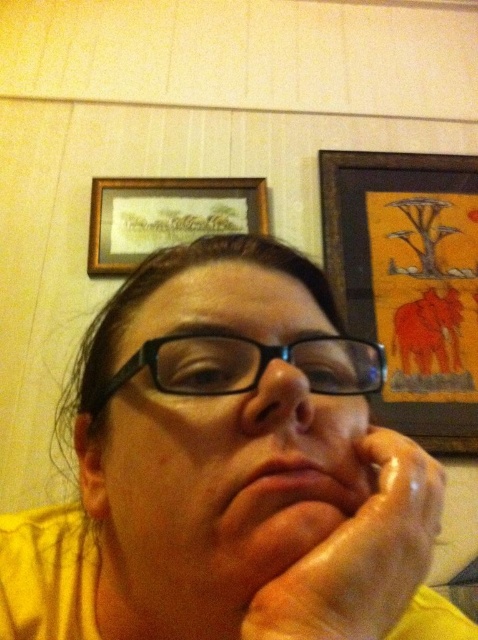
Question: Can you confirm if wooden frame at upper center is positioned above matte skin at center?

Choices:
 (A) no
 (B) yes

Answer: (B)

Question: Which point is farther from the camera taking this photo?

Choices:
 (A) (306, 531)
 (B) (357, 253)

Answer: (B)

Question: Which is nearer to the wooden frame at upper center?

Choices:
 (A) black plastic glasses at center
 (B) matte skin nose at center
 (C) matte black glasses at center
 (D) wooden framed artwork at upper right

Answer: (D)

Question: Is yellow matte skin at center positioned before matte black glasses at center?

Choices:
 (A) yes
 (B) no

Answer: (A)

Question: Can you confirm if matte black glasses at center is bigger than wooden framed artwork at upper right?

Choices:
 (A) yes
 (B) no

Answer: (B)

Question: Estimate the real-world distances between objects in this image. Which object is farther from the matte skin at center?

Choices:
 (A) black plastic glasses at center
 (B) dry skin at center
 (C) matte skin nose at center

Answer: (A)